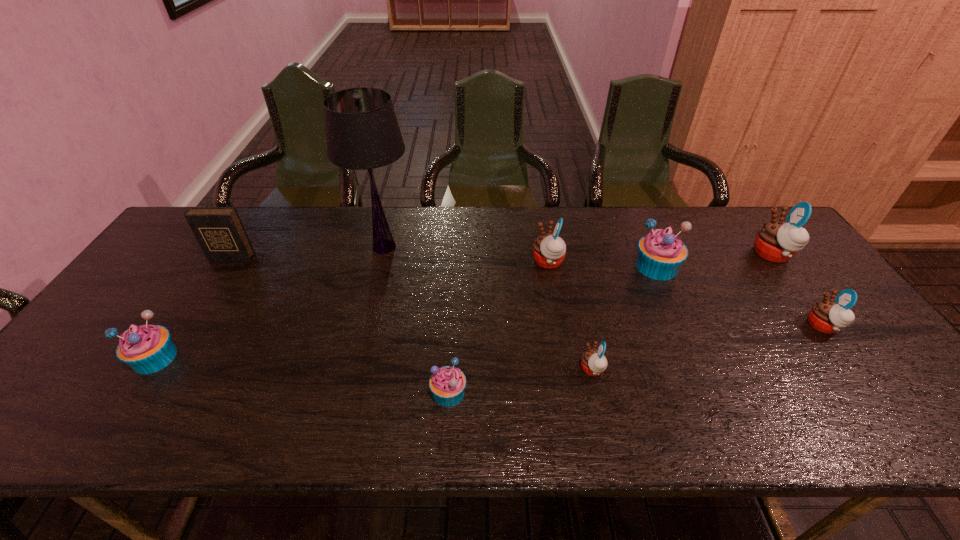
Where is `the second biggest blue muffin`? The width and height of the screenshot is (960, 540). the second biggest blue muffin is located at coordinates (147, 349).

The width and height of the screenshot is (960, 540). In order to click on the nearest pink muffin in this screenshot , I will do `click(593, 362)`.

Where is `the sixth object from right to left`? The height and width of the screenshot is (540, 960). the sixth object from right to left is located at coordinates (447, 384).

Locate an element on the screen. the second blue muffin from right to left is located at coordinates (447, 384).

Image resolution: width=960 pixels, height=540 pixels. I want to click on free space located on the front-facing side of the lampshade, so click(x=360, y=343).

At what (x,y) coordinates should I click in order to perform the action: click on free location located 0.070m on the front-facing side of the tallest muffin. Please return your answer as a coordinate pair (x, y). Looking at the image, I should click on (731, 254).

You are a GUI agent. You are given a task and a screenshot of the screen. Output one action in this format:
    pyautogui.click(x=<x>, y=<y>)
    Task: Click on the vacant space situated 0.120m on the front-facing side of the tallest muffin
    
    Given the screenshot: What is the action you would take?
    pyautogui.click(x=714, y=254)

The height and width of the screenshot is (540, 960). What are the coordinates of `free location located on the front-facing side of the tallest muffin` in the screenshot? It's located at (714, 254).

What are the coordinates of `free spot located 0.130m on the front cover of the diary` in the screenshot? It's located at (209, 293).

Identify the location of free space located on the front-facing side of the third smallest pink muffin. (455, 261).